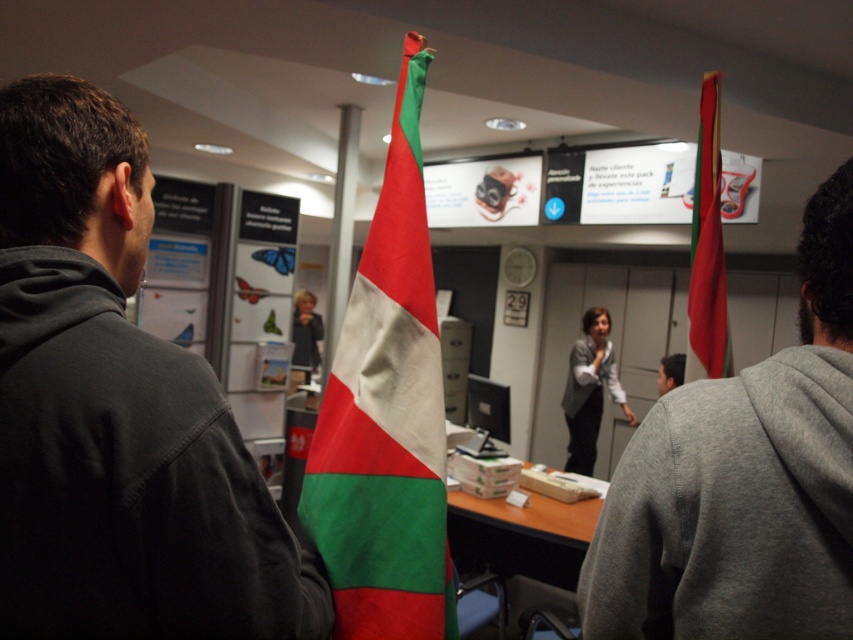
Does gray hoodie at right appear over gray fabric jacket at center?

Yes, gray hoodie at right is above gray fabric jacket at center.

Who is positioned more to the right, gray hoodie at right or gray fabric jacket at center?

gray fabric jacket at center

Describe the element at coordinates (743, 481) in the screenshot. I see `gray hoodie at right` at that location.

Where is `gray hoodie at right`? The height and width of the screenshot is (640, 853). gray hoodie at right is located at coordinates (743, 481).

Between red-green striped flag at center and red fabric flag at upper right, which one appears on the left side from the viewer's perspective?

red-green striped flag at center

Which is behind, point (412, 196) or point (712, 250)?

Point (712, 250)

Where is `red-green striped flag at center`? red-green striped flag at center is located at coordinates (386, 417).

Who is shorter, gray fabric jacket at center or matte black jacket at center?

With less height is matte black jacket at center.

Is gray fabric jacket at center shorter than matte black jacket at center?

In fact, gray fabric jacket at center may be taller than matte black jacket at center.

What do you see at coordinates (590, 388) in the screenshot? I see `gray fabric jacket at center` at bounding box center [590, 388].

Find the location of `gray fabric jacket at center`. gray fabric jacket at center is located at coordinates (590, 388).